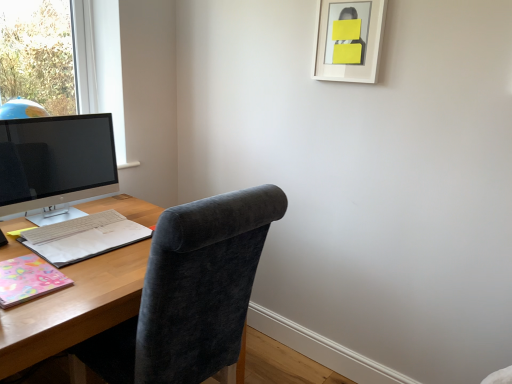
Locate an element on the screen. The width and height of the screenshot is (512, 384). vacant region to the right of pastel floral paper at lower left, which is the 2th notebook from back to front is located at coordinates (94, 279).